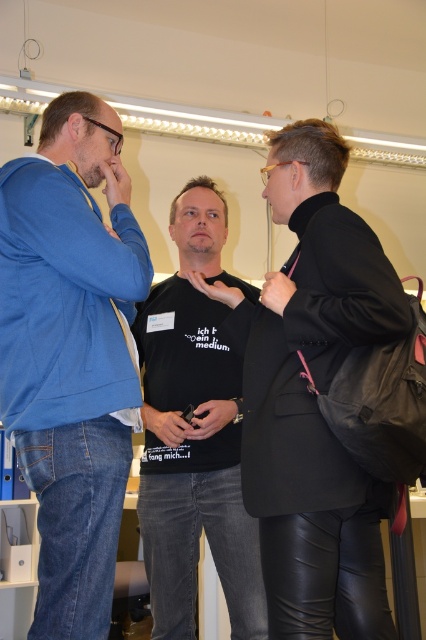
Question: Which point appears farthest from the camera in this image?

Choices:
 (A) (233, 500)
 (B) (293, 444)

Answer: (A)

Question: Can you confirm if black matte t-shirt at center is bigger than black cotton t-shirt at center?

Choices:
 (A) yes
 (B) no

Answer: (A)

Question: Does black matte t-shirt at center appear under black cotton t-shirt at center?

Choices:
 (A) no
 (B) yes

Answer: (A)

Question: Which of these objects is positioned farthest from the black cotton t-shirt at center?

Choices:
 (A) black matte t-shirt at center
 (B) blue denim jeans at left

Answer: (B)

Question: Considering the real-world distances, which object is farthest from the blue denim jeans at left?

Choices:
 (A) black matte t-shirt at center
 (B) black cotton t-shirt at center

Answer: (B)

Question: From the image, what is the correct spatial relationship of blue denim jeans at left in relation to black matte t-shirt at center?

Choices:
 (A) above
 (B) below

Answer: (A)